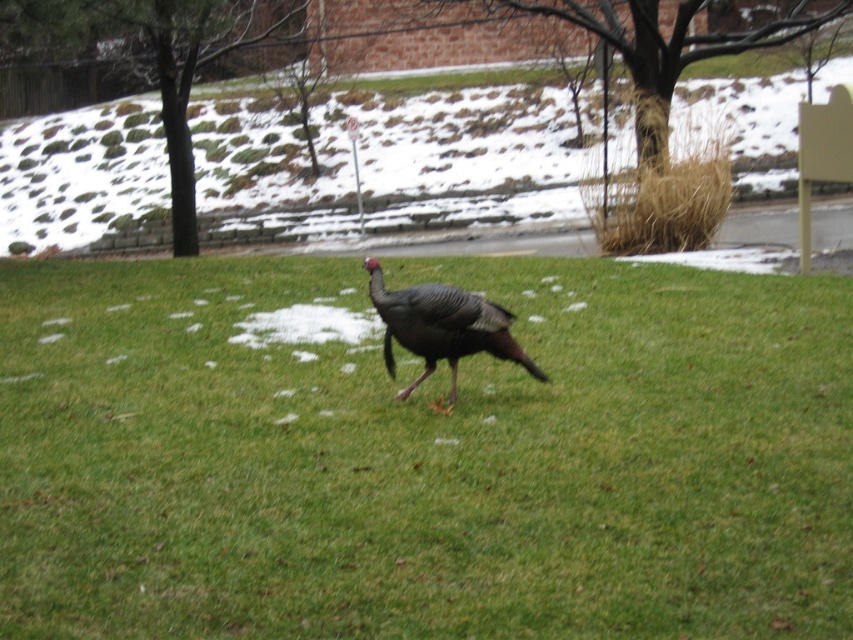
Does point (824, 593) come behind point (538, 369)?

No, (824, 593) is in front of (538, 369).

This screenshot has height=640, width=853. What do you see at coordinates (424, 458) in the screenshot? I see `green grass at center` at bounding box center [424, 458].

Between point (440, 586) and point (474, 310), which one is positioned behind?

The point (474, 310) is more distant.

You are a GUI agent. You are given a task and a screenshot of the screen. Output one action in this format:
    pyautogui.click(x=<x>, y=<y>)
    Task: Click on the green grass at center
    This screenshot has width=853, height=640.
    Given the screenshot: What is the action you would take?
    pyautogui.click(x=424, y=458)